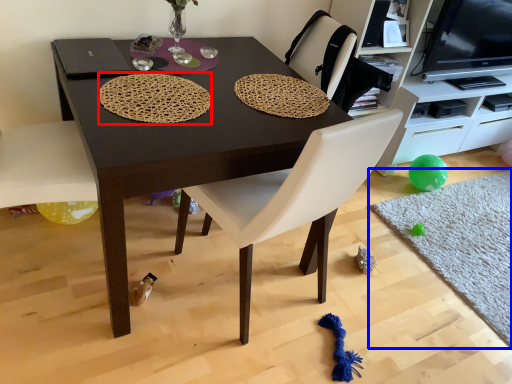
Question: Among these objects, which one is farthest to the camera, mat (highlighted by a red box) or mat (highlighted by a blue box)?

Choices:
 (A) mat
 (B) mat

Answer: (B)